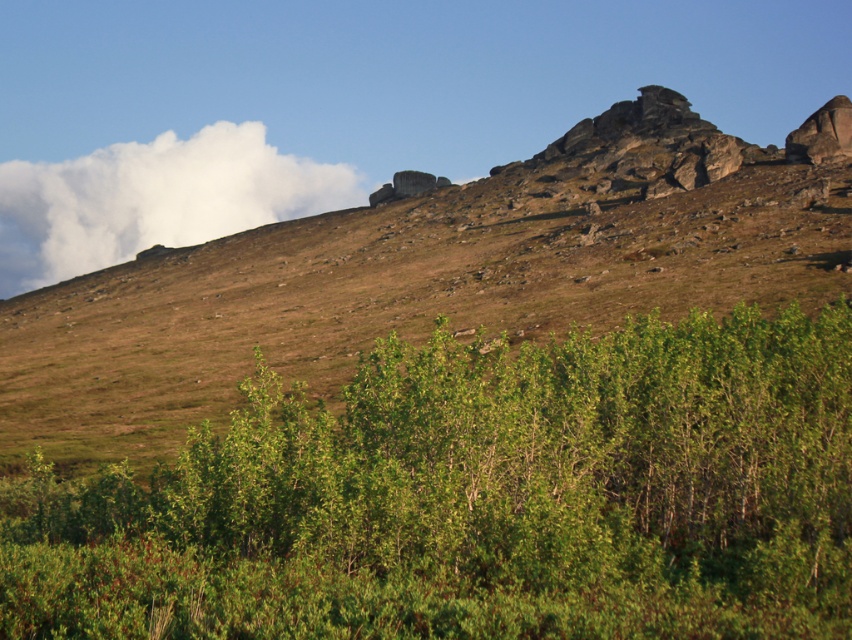
Question: Is green leafy shrubs at lower center below white fluffy cloud at upper left?

Choices:
 (A) yes
 (B) no

Answer: (A)

Question: Which point appears farthest from the camera in this image?

Choices:
 (A) (187, 305)
 (B) (619, 518)
 (C) (214, 182)

Answer: (C)

Question: Is green leafy shrubs at lower center to the left of white fluffy cloud at upper left from the viewer's perspective?

Choices:
 (A) no
 (B) yes

Answer: (A)

Question: Which object appears closest to the camera in this image?

Choices:
 (A) green leafy shrubs at lower center
 (B) white fluffy cloud at upper left

Answer: (A)

Question: Does green leafy shrubs at lower center come behind rugged stone mountain at upper center?

Choices:
 (A) no
 (B) yes

Answer: (A)

Question: Which of the following is the farthest from the observer?

Choices:
 (A) (289, 179)
 (B) (513, 544)

Answer: (A)